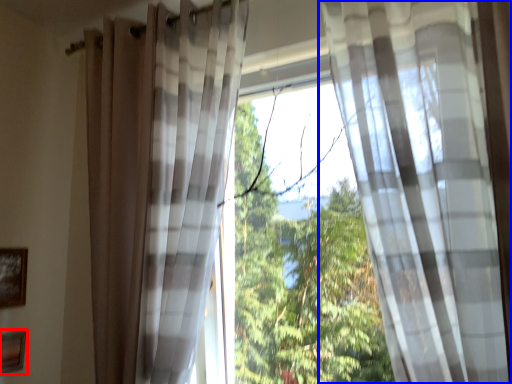
Question: Which object appears closest to the camera in this image, picture frame (highlighted by a red box) or curtain (highlighted by a blue box)?

Choices:
 (A) picture frame
 (B) curtain

Answer: (B)